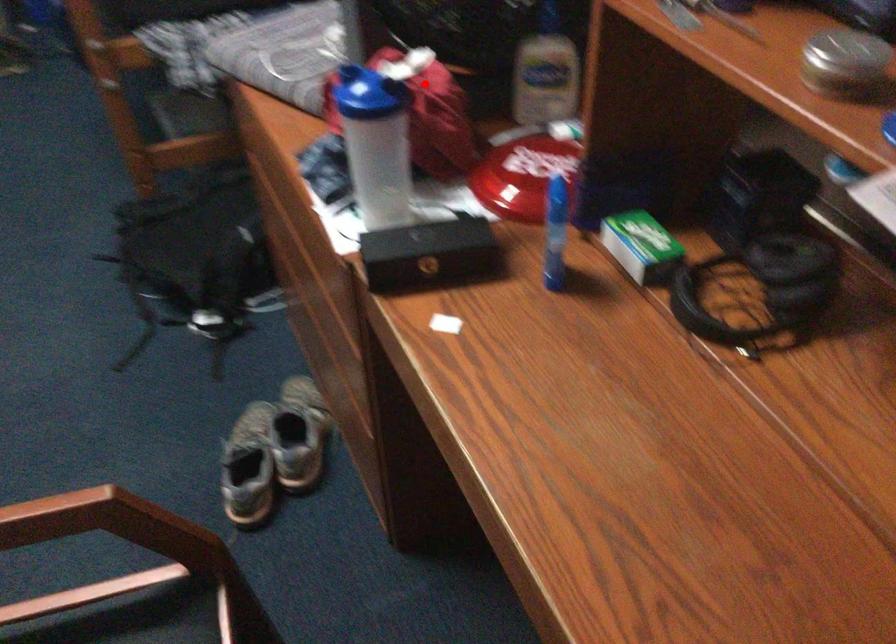
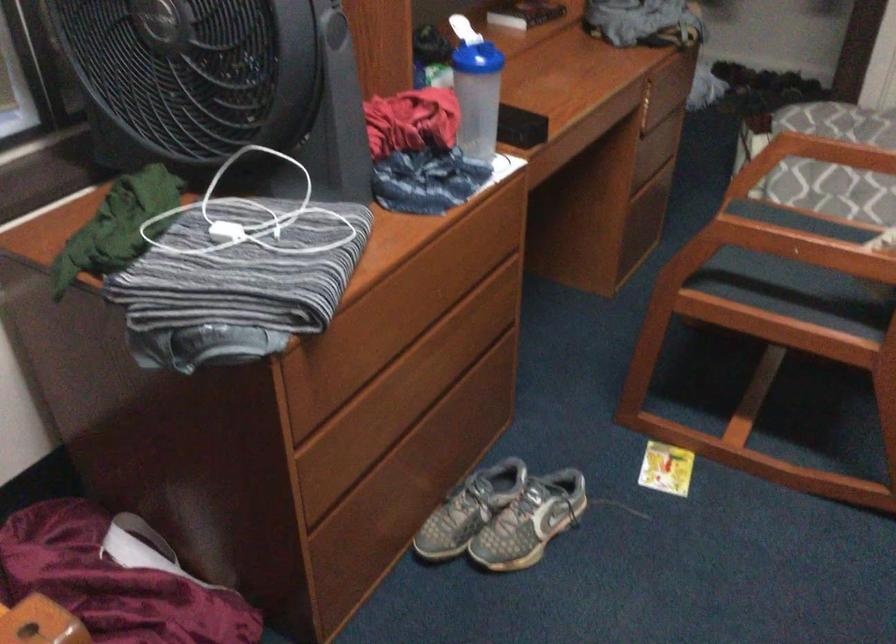
Find the pixel in the second image that matches the highlighted location in the first image.

(462, 29)